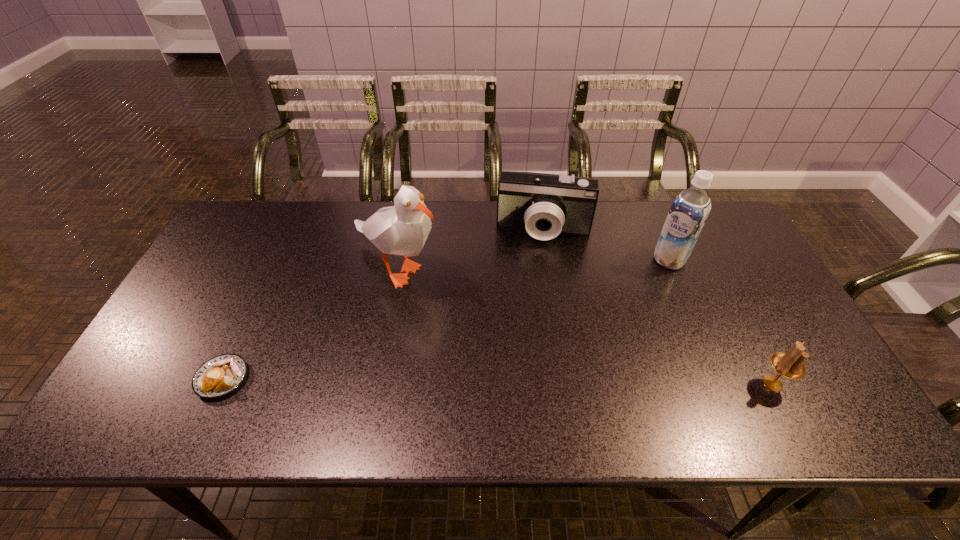
Locate an element on the screen. vacant space on the desktop that is between the pastry and the candle holder and is positioned on the lens of the third object from right to left is located at coordinates (530, 381).

Where is `vacant space on the desktop that is between the leftmost object and the candle holder and is positioned on the label of the soya milk`? The width and height of the screenshot is (960, 540). vacant space on the desktop that is between the leftmost object and the candle holder and is positioned on the label of the soya milk is located at coordinates (557, 381).

This screenshot has width=960, height=540. Find the location of `vacant space on the desktop that is between the pastry and the candle holder and is positioned at the beak of the second object from left to right`. vacant space on the desktop that is between the pastry and the candle holder and is positioned at the beak of the second object from left to right is located at coordinates (431, 380).